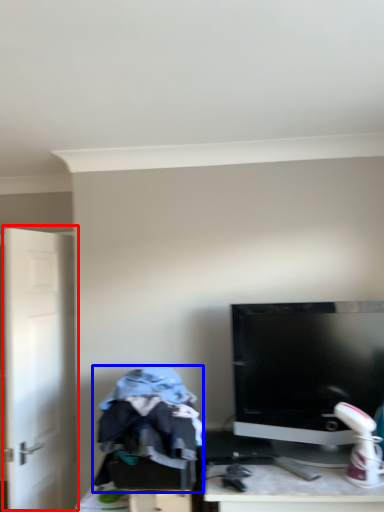
Question: Among these objects, which one is nearest to the camera, door (highlighted by a red box) or clothing (highlighted by a blue box)?

Choices:
 (A) door
 (B) clothing

Answer: (B)